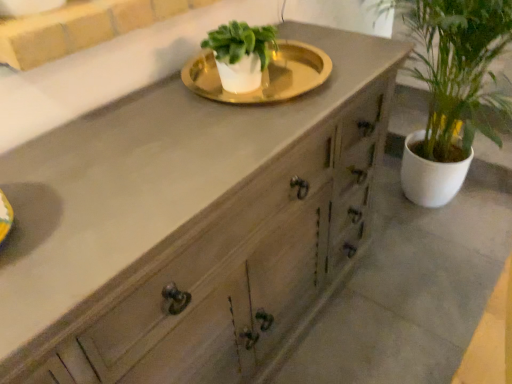
The height and width of the screenshot is (384, 512). What do you see at coordinates (254, 66) in the screenshot? I see `gold metallic tray at center` at bounding box center [254, 66].

You are a GUI agent. You are given a task and a screenshot of the screen. Output one action in this format:
    pyautogui.click(x=<x>, y=<y>)
    Task: Click on the gold metallic tray at center
    The width and height of the screenshot is (512, 384).
    Given the screenshot: What is the action you would take?
    pyautogui.click(x=254, y=66)

At what (x,y) coordinates should I click in order to perform the action: click on gold metallic tray at center. Please return your answer as a coordinate pair (x, y). Looking at the image, I should click on click(254, 66).